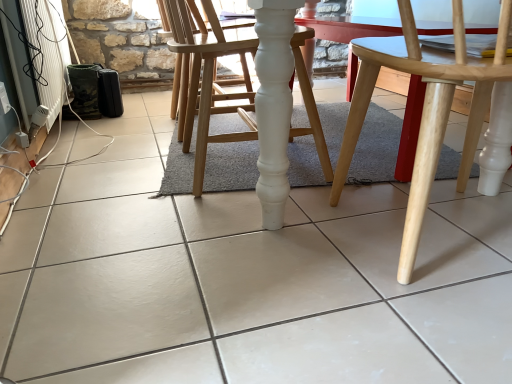
Where is `white wood chair at center, which ranks as the 1th chair in left-to-right order`? white wood chair at center, which ranks as the 1th chair in left-to-right order is located at coordinates (204, 81).

Measure the distance between natural wood chair at center, which is the 1th chair from right to left, and camera.

The distance of natural wood chair at center, which is the 1th chair from right to left, from camera is 49.45 centimeters.

What do you see at coordinates (424, 108) in the screenshot? This screenshot has width=512, height=384. I see `natural wood chair at center, the second chair from the left` at bounding box center [424, 108].

Where is `white wood chair at center, the second chair positioned from the right`? The height and width of the screenshot is (384, 512). white wood chair at center, the second chair positioned from the right is located at coordinates (204, 81).

Can you see white plastic radiator at lower left touching white wood chair at center, which ranks as the 1th chair in left-to-right order?

No, white plastic radiator at lower left is not beside white wood chair at center, which ranks as the 1th chair in left-to-right order.

Measure the distance from white plastic radiator at lower left to white wood chair at center, the second chair positioned from the right.

white plastic radiator at lower left and white wood chair at center, the second chair positioned from the right, are 26.43 inches apart.

Does white plastic radiator at lower left turn towards white wood chair at center, which ranks as the 1th chair in left-to-right order?

Yes, white plastic radiator at lower left faces towards white wood chair at center, which ranks as the 1th chair in left-to-right order.

Looking at their sizes, would you say white plastic radiator at lower left is wider or thinner than natural wood chair at center, which is the 1th chair from right to left?

Considering their sizes, white plastic radiator at lower left looks slimmer than natural wood chair at center, which is the 1th chair from right to left.

Is white plastic radiator at lower left positioned with its back to natural wood chair at center, which is the 1th chair from right to left?

white plastic radiator at lower left does not have its back to natural wood chair at center, which is the 1th chair from right to left.

Which chair is the 2nd one when counting from the front of the white plastic radiator at lower left? Please provide its 2D coordinates.

[(424, 108)]

Considering the points (57, 14) and (365, 79), which point is in front, point (57, 14) or point (365, 79)?

The point (365, 79) is closer to the camera.

Considering the sizes of white wood chair at center, the second chair positioned from the right, and white plastic radiator at lower left in the image, is white wood chair at center, the second chair positioned from the right, taller or shorter than white plastic radiator at lower left?

In the image, white wood chair at center, the second chair positioned from the right, appears to be taller than white plastic radiator at lower left.

Is white wood chair at center, which ranks as the 1th chair in left-to-right order, positioned far away from white plastic radiator at lower left?

No.

From the image's perspective, which one is positioned lower, white wood chair at center, the second chair positioned from the right, or white plastic radiator at lower left?

white wood chair at center, the second chair positioned from the right, from the image's perspective.

From the image's perspective, starting from the white plastic radiator at lower left, which chair is the 1st one below? Please provide its 2D coordinates.

[(204, 81)]

Do you think natural wood chair at center, the second chair from the left, is within white plastic radiator at lower left, or outside of it?

natural wood chair at center, the second chair from the left, is not inside white plastic radiator at lower left, it's outside.

Between natural wood chair at center, which is the 1th chair from right to left, and white plastic radiator at lower left, which one has larger width?

natural wood chair at center, which is the 1th chair from right to left, is wider.

Is natural wood chair at center, the second chair from the left, aimed at white plastic radiator at lower left?

No, natural wood chair at center, the second chair from the left, does not turn towards white plastic radiator at lower left.

Does natural wood chair at center, the second chair from the left, come in front of white wood chair at center, the second chair positioned from the right?

Yes, natural wood chair at center, the second chair from the left, is closer to the viewer.

How different are the orientations of natural wood chair at center, the second chair from the left, and white wood chair at center, which ranks as the 1th chair in left-to-right order, in degrees?

The facing directions of natural wood chair at center, the second chair from the left, and white wood chair at center, which ranks as the 1th chair in left-to-right order, are 90 degrees apart.

Are natural wood chair at center, which is the 1th chair from right to left, and white wood chair at center, which ranks as the 1th chair in left-to-right order, making contact?

No, natural wood chair at center, which is the 1th chair from right to left, is not making contact with white wood chair at center, which ranks as the 1th chair in left-to-right order.

Which object is thinner, natural wood chair at center, which is the 1th chair from right to left, or white wood chair at center, the second chair positioned from the right?

With smaller width is white wood chair at center, the second chair positioned from the right.

From the image's perspective, is white wood chair at center, which ranks as the 1th chair in left-to-right order, located beneath natural wood chair at center, which is the 1th chair from right to left?

Incorrect, from the image's perspective, white wood chair at center, which ranks as the 1th chair in left-to-right order, is higher than natural wood chair at center, which is the 1th chair from right to left.

Which of these two, white wood chair at center, the second chair positioned from the right, or natural wood chair at center, the second chair from the left, is wider?

Wider between the two is natural wood chair at center, the second chair from the left.

Who is smaller, white wood chair at center, the second chair positioned from the right, or natural wood chair at center, the second chair from the left?

Smaller between the two is white wood chair at center, the second chair positioned from the right.

In the image, is white wood chair at center, the second chair positioned from the right, on the left side or the right side of natural wood chair at center, the second chair from the left?

white wood chair at center, the second chair positioned from the right, is positioned on natural wood chair at center, the second chair from the left,'s left side.

Locate an element on the screen. The width and height of the screenshot is (512, 384). the 1st chair in front of the white plastic radiator at lower left, counting from the anchor's position is located at coordinates (204, 81).

The width and height of the screenshot is (512, 384). Find the location of `the 2nd chair below the white plastic radiator at lower left (from the image's perspective)`. the 2nd chair below the white plastic radiator at lower left (from the image's perspective) is located at coordinates (424, 108).

Looking at the image, which one is located further to white wood chair at center, the second chair positioned from the right, white plastic radiator at lower left or natural wood chair at center, which is the 1th chair from right to left?

white plastic radiator at lower left is positioned further to the anchor white wood chair at center, the second chair positioned from the right.

Based on their spatial positions, is white wood chair at center, the second chair positioned from the right, or natural wood chair at center, the second chair from the left, closer to white plastic radiator at lower left?

white wood chair at center, the second chair positioned from the right.

Based on their spatial positions, is natural wood chair at center, which is the 1th chair from right to left, or white plastic radiator at lower left closer to white wood chair at center, the second chair positioned from the right?

Based on the image, natural wood chair at center, which is the 1th chair from right to left, appears to be nearer to white wood chair at center, the second chair positioned from the right.

From the image, which object appears to be nearer to natural wood chair at center, which is the 1th chair from right to left, white plastic radiator at lower left or white wood chair at center, which ranks as the 1th chair in left-to-right order?

white wood chair at center, which ranks as the 1th chair in left-to-right order.

Based on their spatial positions, is natural wood chair at center, the second chair from the left, or white wood chair at center, which ranks as the 1th chair in left-to-right order, closer to white plastic radiator at lower left?

white wood chair at center, which ranks as the 1th chair in left-to-right order, lies closer to white plastic radiator at lower left than the other object.

When comparing their distances from natural wood chair at center, the second chair from the left, does white wood chair at center, which ranks as the 1th chair in left-to-right order, or white plastic radiator at lower left seem further?

The object further to natural wood chair at center, the second chair from the left, is white plastic radiator at lower left.

Find the location of a particular element. Image resolution: width=512 pixels, height=384 pixels. chair between white plastic radiator at lower left and natural wood chair at center, which is the 1th chair from right to left is located at coordinates (204, 81).